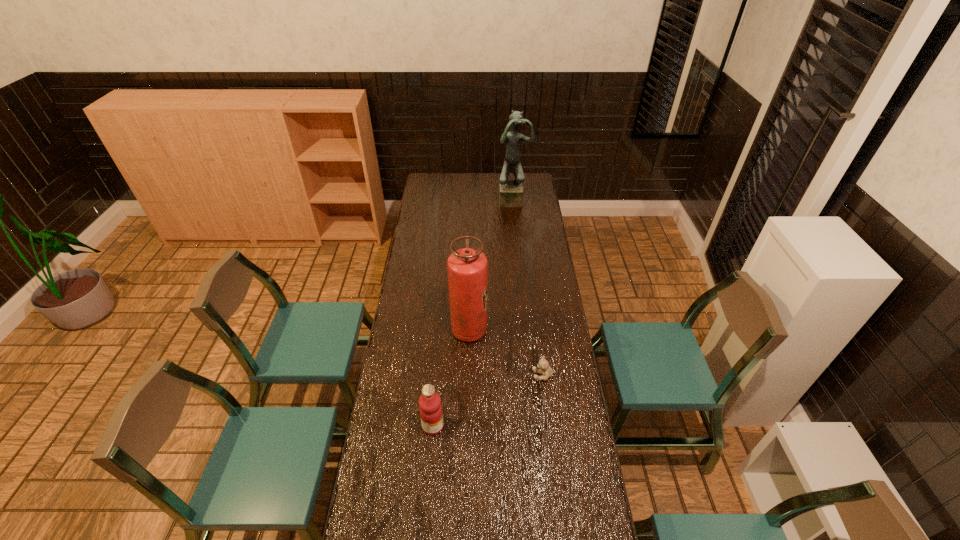
This screenshot has height=540, width=960. Identify the location of vacant space that satisfies the following two spatial constraints: 1. on the face of the sculpture; 2. on the label of the second shortest object. (536, 426).

The height and width of the screenshot is (540, 960). Find the location of `free spot that satisfies the following two spatial constraints: 1. on the face of the sculpture; 2. on the label side of the second farthest object`. free spot that satisfies the following two spatial constraints: 1. on the face of the sculpture; 2. on the label side of the second farthest object is located at coordinates (526, 330).

Find the location of a particular element. This screenshot has height=540, width=960. vacant area in the image that satisfies the following two spatial constraints: 1. on the face of the farthest object; 2. on the label of the third tallest object is located at coordinates (536, 426).